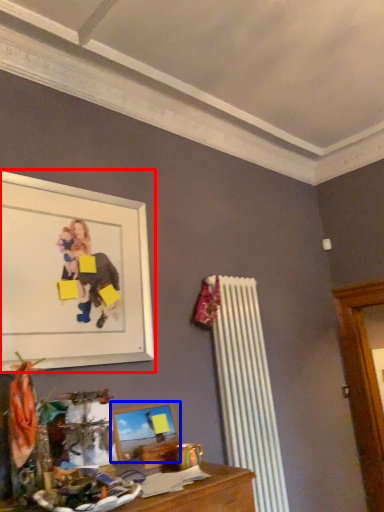
Question: Which of the following is the closest to the observer, picture frame (highlighted by a red box) or picture frame (highlighted by a blue box)?

Choices:
 (A) picture frame
 (B) picture frame

Answer: (A)